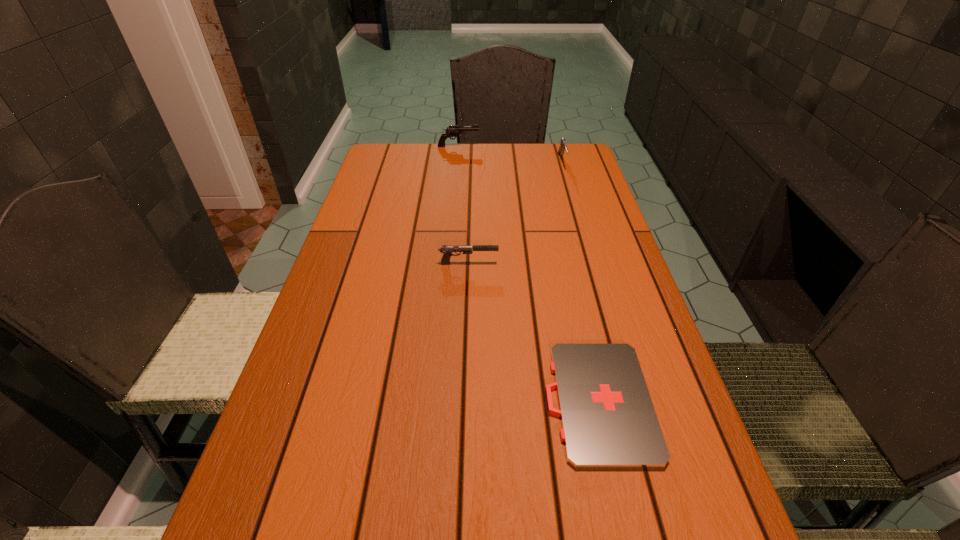
This screenshot has height=540, width=960. In order to click on free space that is in between the farthest object and the second farthest gun in this screenshot , I will do `click(511, 154)`.

The width and height of the screenshot is (960, 540). I want to click on free space between the first-aid kit and the nearest gun, so click(x=533, y=332).

You are a GUI agent. You are given a task and a screenshot of the screen. Output one action in this format:
    pyautogui.click(x=<x>, y=<y>)
    Task: Click on the vacant area that lies between the second nearest object and the nearest object
    The width and height of the screenshot is (960, 540).
    Given the screenshot: What is the action you would take?
    pyautogui.click(x=533, y=332)

This screenshot has height=540, width=960. I want to click on empty location between the second shortest object and the nearest object, so click(x=533, y=332).

Identify the location of free point between the second shortest object and the second nearest gun. This screenshot has width=960, height=540. (516, 213).

I want to click on vacant point located between the first-aid kit and the third nearest object, so click(580, 282).

The width and height of the screenshot is (960, 540). In order to click on free space between the farthest object and the nearest object in this screenshot , I will do `click(528, 274)`.

Where is `unoccupied area between the shortest object and the second farthest object`? unoccupied area between the shortest object and the second farthest object is located at coordinates (580, 282).

This screenshot has width=960, height=540. Identify the location of empty location between the third farthest object and the farthest gun. (464, 205).

The image size is (960, 540). Identify the location of free space between the rightmost gun and the shortest object. 580,282.